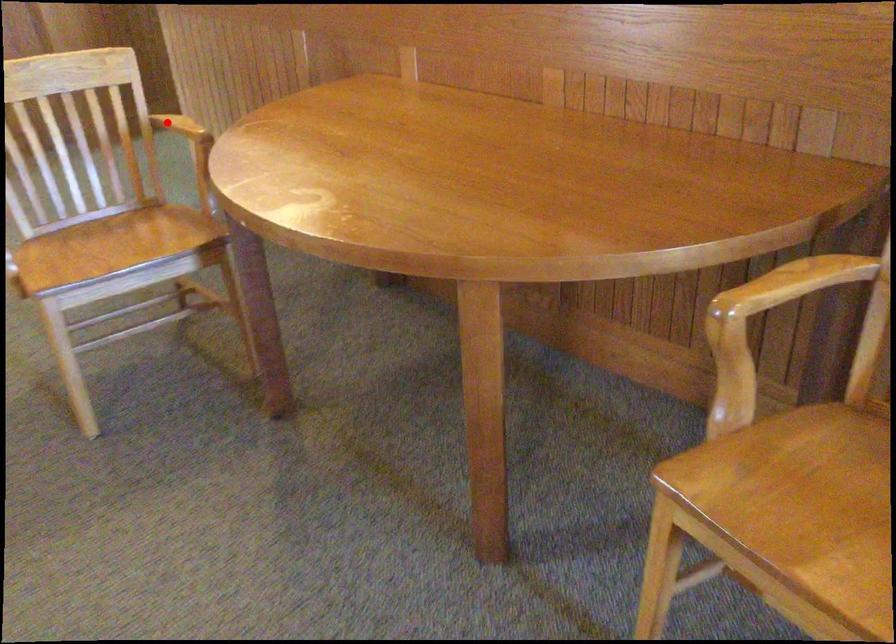
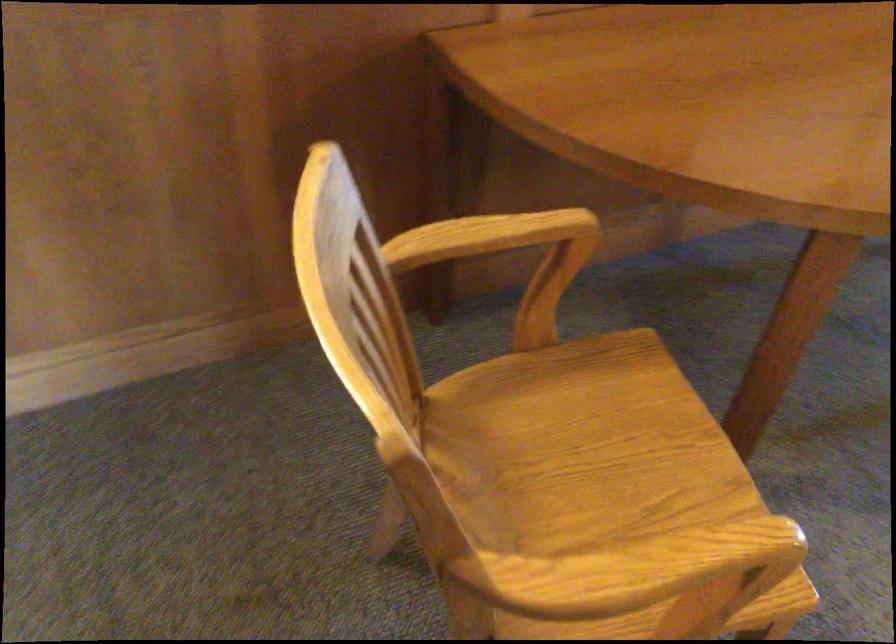
Locate, in the second image, the point that corresponds to the highlighted location in the first image.

(488, 237)